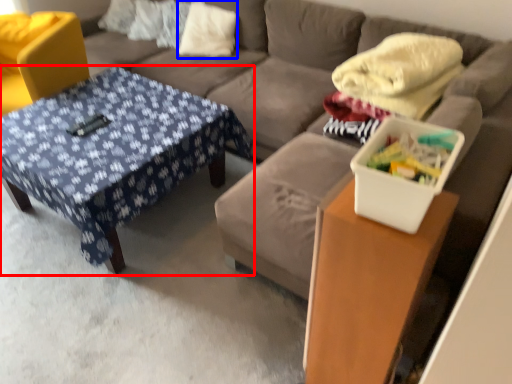
Question: Which object appears closest to the camera in this image, table (highlighted by a red box) or pillow (highlighted by a blue box)?

Choices:
 (A) table
 (B) pillow

Answer: (A)